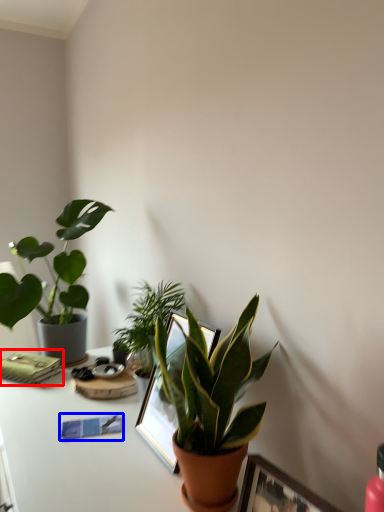
Question: Which of the following is the closest to the observer, paperback book (highlighted by a red box) or journal (highlighted by a blue box)?

Choices:
 (A) paperback book
 (B) journal

Answer: (B)